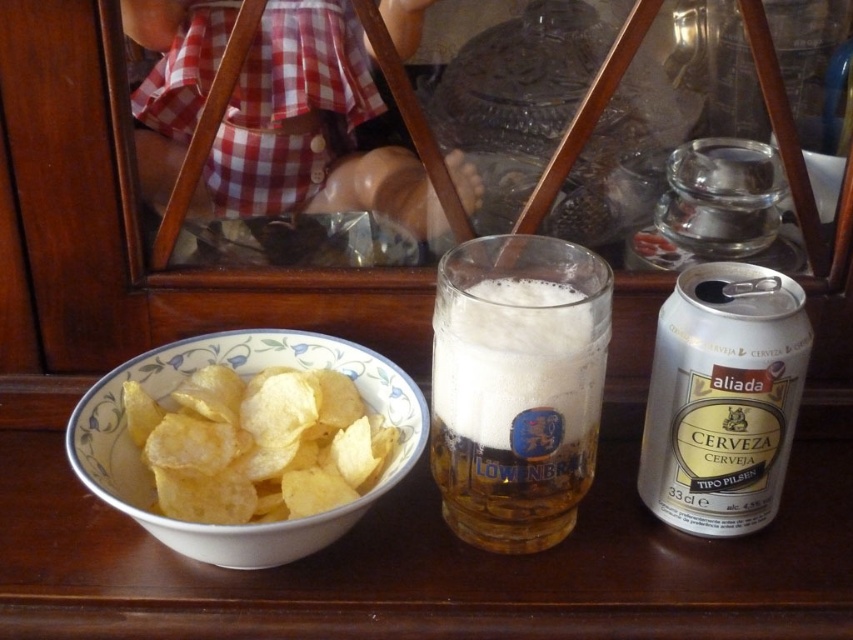
You are at a casual dining table and want to place a small coaster under the foamy glass beer at center and the silver metallic can at right. Which object requires a larger coaster to cover its base completely?

The silver metallic can at right requires a larger coaster because it is taller than the foamy glass beer at center.

You are at a casual dining table and want to place a napkin between the foamy glass beer at center and the silver metallic can at right. Based on their positions, which object should you place the napkin closer to the left side of?

The foamy glass beer at center is positioned on the left side of silver metallic can at right, so you should place the napkin closer to the left side of the foamy glass beer at center.

You are a waiter at a restaurant and need to place a new drink order on the table. The customer wants the drink placed closer to the edge of the table than the existing silver metallic can at right. Where should you place the new drink relative to the golden crispy chips at left?

The silver metallic can at right is located above the golden crispy chips at left, so placing the new drink closer to the edge of the table would mean positioning it below the golden crispy chips at left.